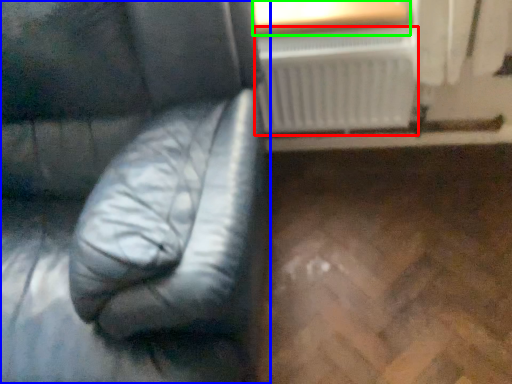
Question: Based on their relative distances, which object is farther from radiator (highlighted by a red box)? Choose from furniture (highlighted by a blue box) and window frame (highlighted by a green box).

Choices:
 (A) furniture
 (B) window frame

Answer: (A)